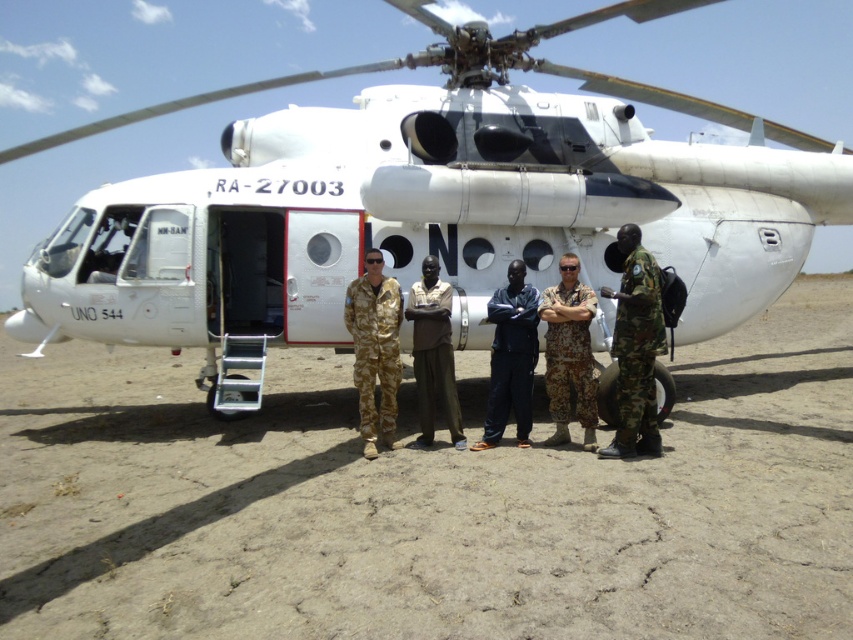
Question: Is white matte helicopter at center in front of camouflage uniform at center?

Choices:
 (A) yes
 (B) no

Answer: (B)

Question: Does camouflage fabric uniform at center appear on the right side of camouflage uniform at center?

Choices:
 (A) yes
 (B) no

Answer: (A)

Question: Which of the following is the farthest from the observer?

Choices:
 (A) (392, 324)
 (B) (621, 396)
 (C) (302, 497)

Answer: (A)

Question: Which object is closer to the camera taking this photo?

Choices:
 (A) camouflage fabric uniform at center
 (B) white matte helicopter at center
 (C) dark blue pants at center
 (D) camouflage fabric pants at center

Answer: (A)

Question: Can you confirm if camouflage fabric uniform at center is positioned to the left of dark blue pants at center?

Choices:
 (A) yes
 (B) no

Answer: (B)

Question: Which object appears closest to the camera in this image?

Choices:
 (A) brown fabric pants at center
 (B) camouflage fabric uniform at center
 (C) camouflage uniform at center

Answer: (B)